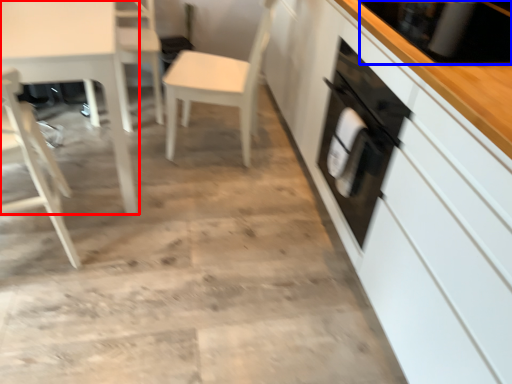
Question: Among these objects, which one is farthest to the camera, table (highlighted by a red box) or appliance (highlighted by a blue box)?

Choices:
 (A) table
 (B) appliance

Answer: (A)